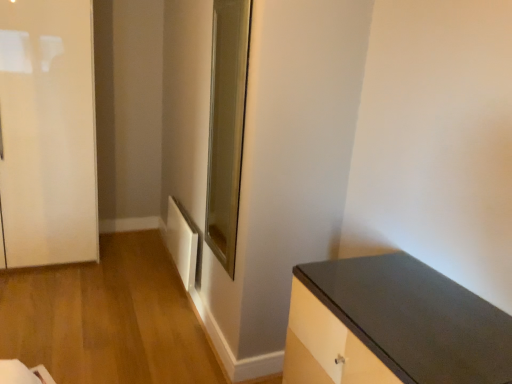
Identify the location of free point above matte black countertop at lower right (from a real-world perspective). The image size is (512, 384). (x=389, y=302).